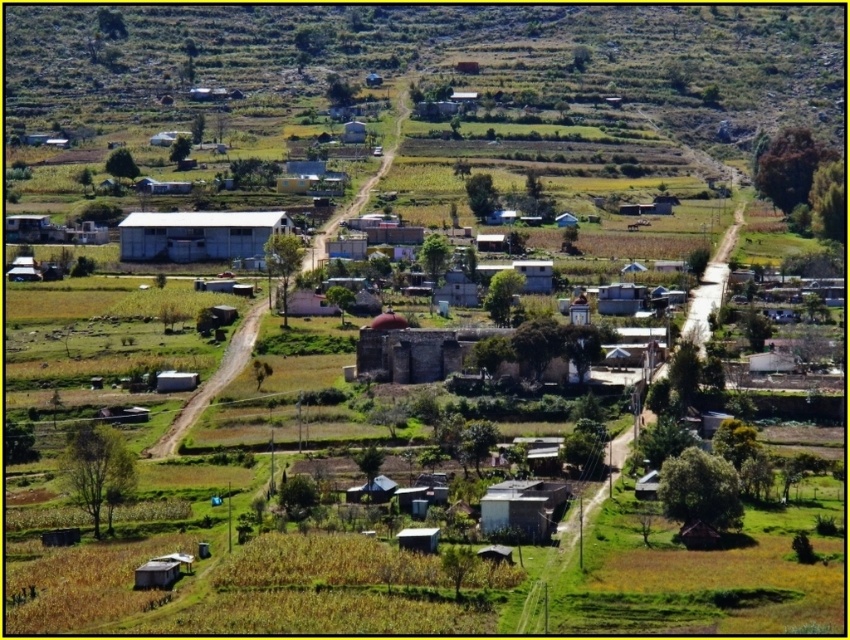
Looking at this image, you are a tourist in the village and want to visit both the white corrugated metal building at center and the white matte hut at center. If you start from the village entrance located to the east, which building should you head towards first to reach them in the correct order?

The white corrugated metal building at center is positioned on the left side of the white matte hut at center. Since you are coming from the east, the white corrugated metal building at center would be on your left, so you should visit it first before proceeding to the white matte hut at center on the right.

You are standing at the point labeled as point (197, 234) in the image. Looking around, you see the white corrugated metal building at center. What is the primary material used for the roof of the building you are facing?

The white corrugated metal building at center has a roof made of corrugated metal.

You are a farmer planning to place a new shed between the white corrugated metal building at center and the white matte hut at center. Given that the shed requires a space twice as wide as the narrower of the two buildings, will there be enough space between them?

The white corrugated metal building at center is wider than the white matte hut at center. The shed requires space twice the width of the narrower building, which is the white matte hut at center. However, the description does not provide the distance between the two buildings, so we cannot determine if there is sufficient space.